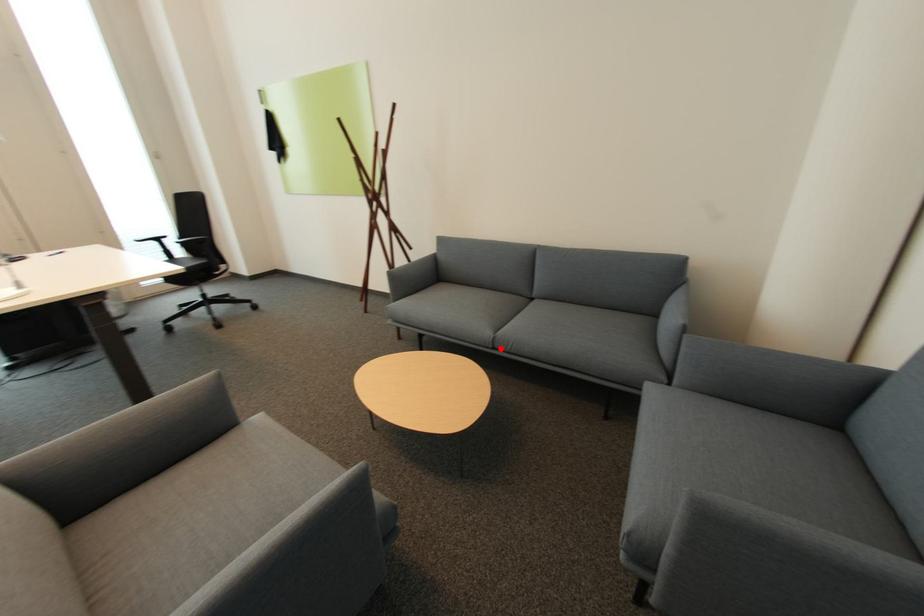
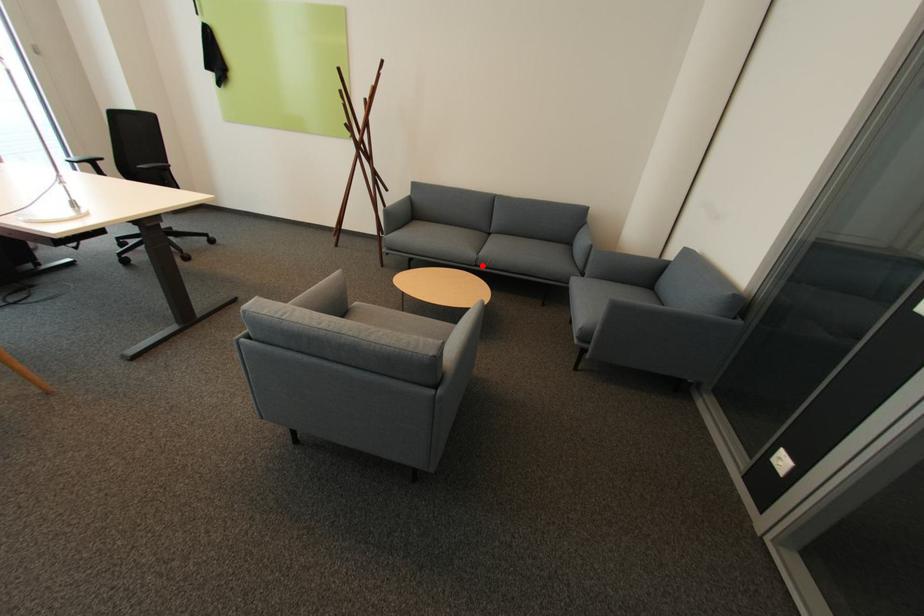
From the picture: I am providing you with two images of the same scene from different viewpoints. A red point is marked on the first image and another point is marked on the second image. Are the points marked in image1 and image2 representing the same 3D position?

Yes